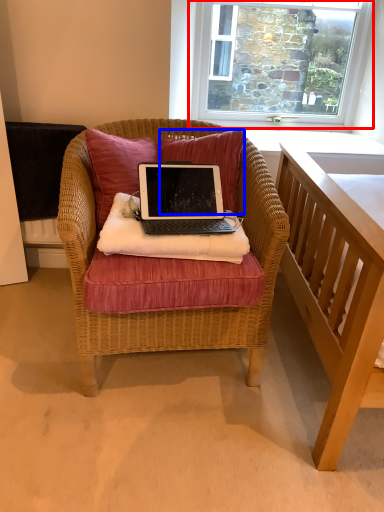
Question: Which object appears closest to the camera in this image, window (highlighted by a red box) or pillow (highlighted by a blue box)?

Choices:
 (A) window
 (B) pillow

Answer: (B)